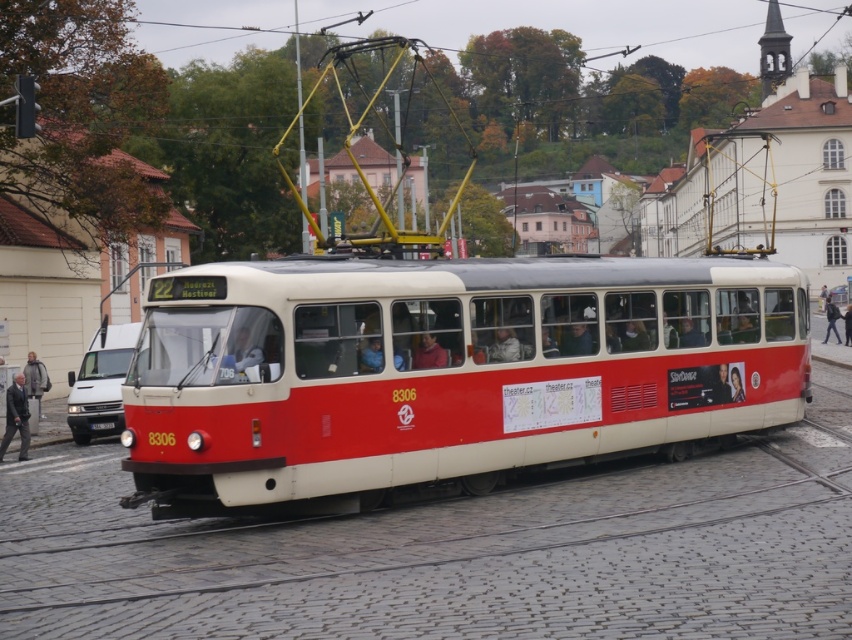
Question: Based on their relative distances, which object is nearer to the dark blue jeans at center?

Choices:
 (A) matte red jacket at center
 (B) red rubber track at center

Answer: (A)

Question: Which object appears farthest from the camera in this image?

Choices:
 (A) gray fabric coat at lower left
 (B) dark gray jacket at left
 (C) dark blue jacket at center

Answer: (C)

Question: Can you confirm if gray fabric coat at lower left is smaller than matte black jacket at center?

Choices:
 (A) no
 (B) yes

Answer: (A)

Question: Among these points, which one is nearest to the camera?

Choices:
 (A) coord(50,384)
 (B) coord(593,340)
 (C) coord(413,356)
 (D) coord(499,353)

Answer: (C)

Question: Does matte red jacket at center have a larger size compared to dark blue jeans at center?

Choices:
 (A) no
 (B) yes

Answer: (A)

Question: Is gray fabric coat at lower left further to camera compared to matte black jacket at center?

Choices:
 (A) yes
 (B) no

Answer: (A)